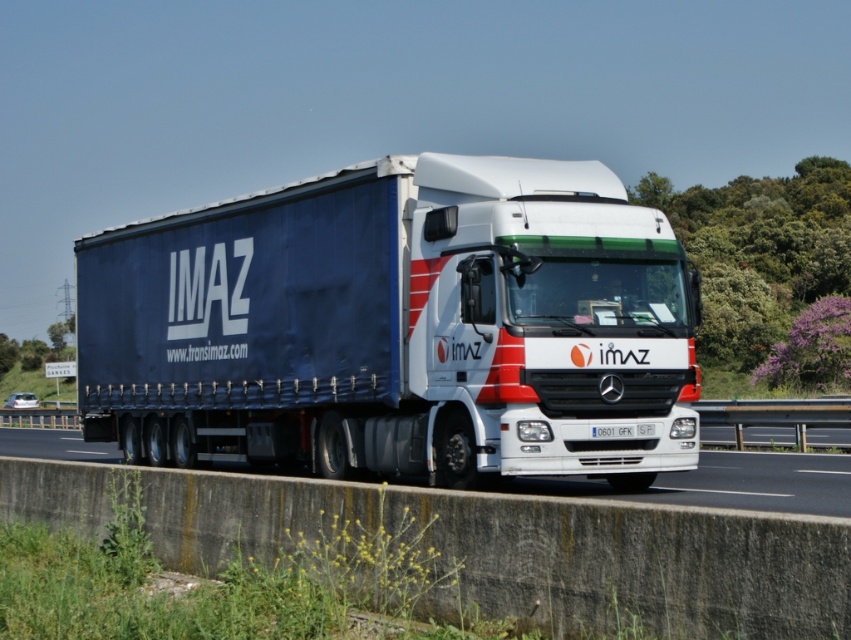
Can you confirm if blue fabric trailer truck at center is bigger than concrete barrier at lower center?

Actually, blue fabric trailer truck at center might be smaller than concrete barrier at lower center.

This screenshot has width=851, height=640. Identify the location of blue fabric trailer truck at center. (398, 326).

From the picture: Between concrete barrier at lower center and white plastic license plate at center, which one is positioned higher?

white plastic license plate at center is above.

Who is more distant from viewer, (530,484) or (627,429)?

The point (530,484) is behind.

Identify the location of concrete barrier at lower center. (728, 483).

Between blue fabric trailer truck at center and white plastic license plate at center, which one is positioned higher?

blue fabric trailer truck at center

Who is lower down, blue fabric trailer truck at center or white plastic license plate at center?

Positioned lower is white plastic license plate at center.

Which is behind, point (432, 269) or point (646, 429)?

The point (432, 269) is more distant.

The width and height of the screenshot is (851, 640). What are the coordinates of `blue fabric trailer truck at center` in the screenshot? It's located at (398, 326).